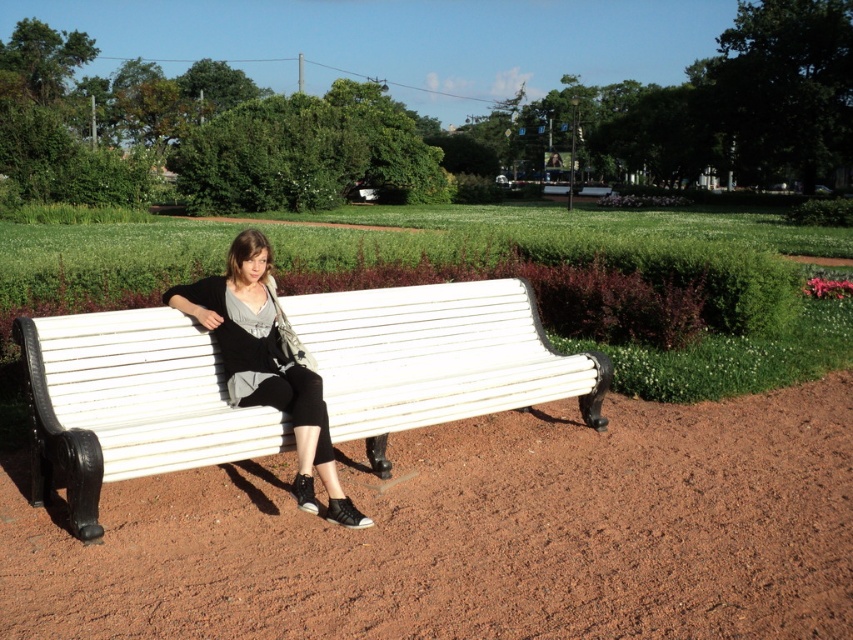
Is white painted wood bench at center further to camera compared to matte black pants at center?

Yes, it is.

Does white painted wood bench at center have a greater width compared to matte black pants at center?

Correct, the width of white painted wood bench at center exceeds that of matte black pants at center.

Does point (178, 339) come closer to viewer compared to point (260, 241)?

That is False.

Find the location of a particular element. The width and height of the screenshot is (853, 640). white painted wood bench at center is located at coordinates (131, 404).